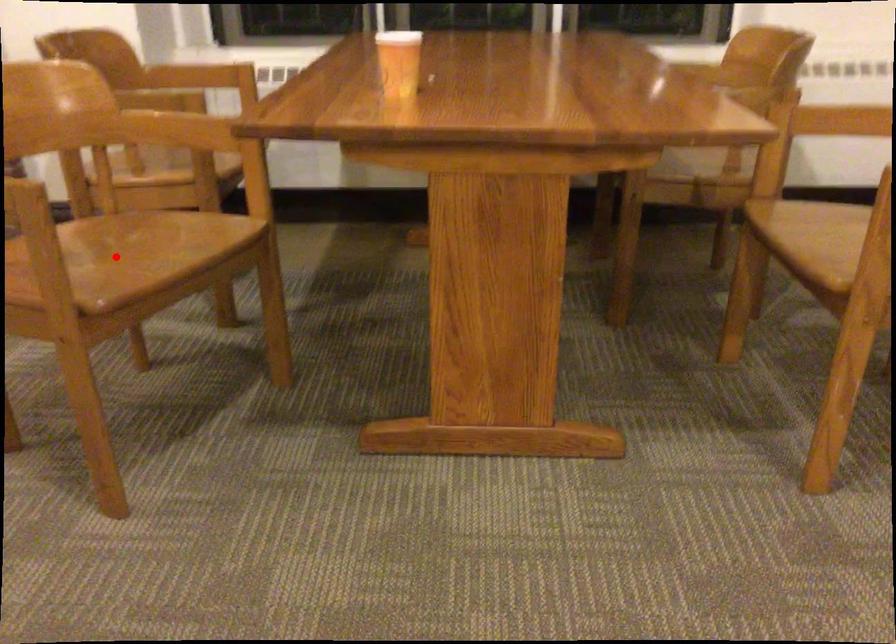
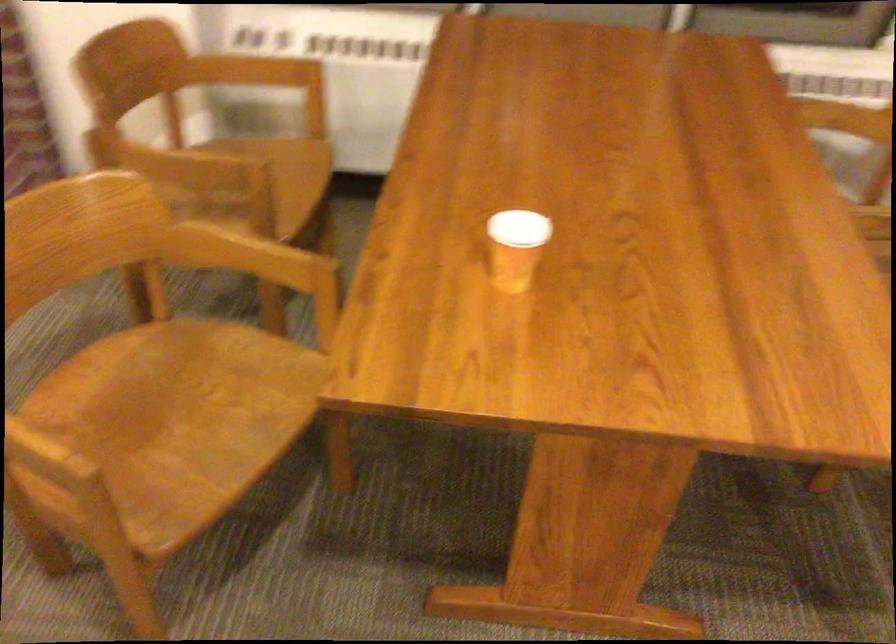
Question: I am providing you with two images of the same scene from different viewpoints. A red point is marked on the first image. Is the red point's position out of view in image 2?

Choices:
 (A) Yes
 (B) No

Answer: (B)